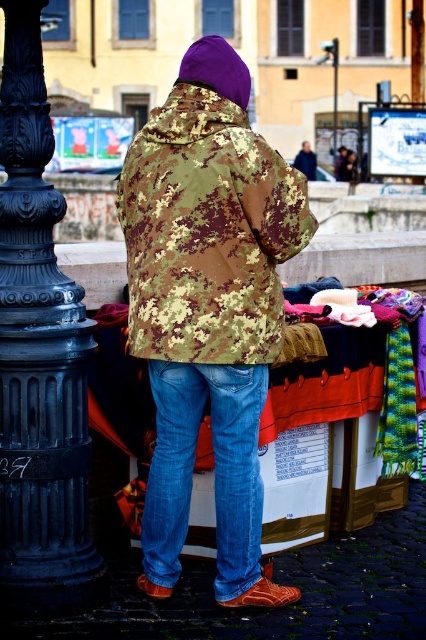
Question: Which of the following is the farthest from the observer?

Choices:
 (A) camouflage fabric jacket at center
 (B) metallic pole at upper center

Answer: (B)

Question: From the image, what is the correct spatial relationship of denim jeans at lower center in relation to blue denim jeans at lower center?

Choices:
 (A) right
 (B) left

Answer: (B)

Question: From the image, what is the correct spatial relationship of denim jeans at lower center in relation to metallic pole at upper center?

Choices:
 (A) below
 (B) above

Answer: (A)

Question: Which point is closer to the camera taking this photo?

Choices:
 (A) (163, 477)
 (B) (302, 173)
 (C) (317, 60)
 (D) (42, 136)

Answer: (D)

Question: Is camouflage fabric jacket at center wider than denim jeans at lower center?

Choices:
 (A) no
 (B) yes

Answer: (B)

Question: Which point is closer to the camera?

Choices:
 (A) (241, 582)
 (B) (317, 60)

Answer: (A)